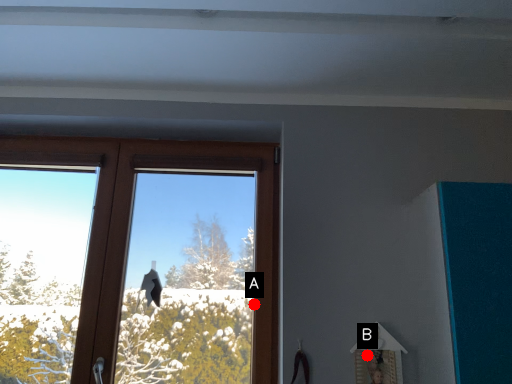
Question: Two points are circled on the image, labeled by A and B beside each circle. Among these points, which one is nearest to the camera?

Choices:
 (A) A is closer
 (B) B is closer

Answer: (B)